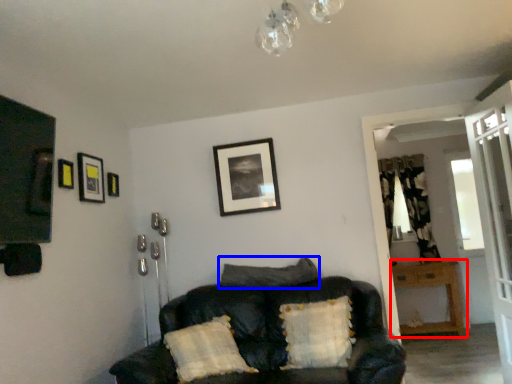
Question: Which of the following is the closest to the observer, table (highlighted by a red box) or pillow (highlighted by a blue box)?

Choices:
 (A) table
 (B) pillow

Answer: (B)